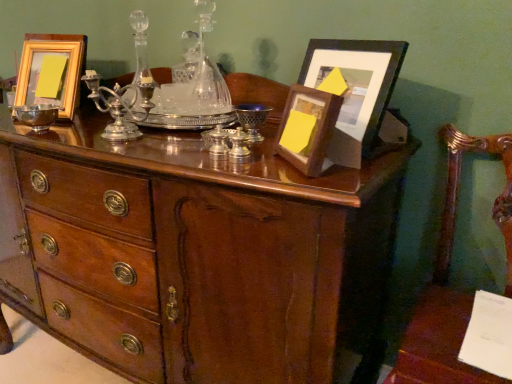
Locate an element on the screen. Image resolution: width=512 pixels, height=384 pixels. shiny silver wine glass at center is located at coordinates (252, 119).

Describe the element at coordinates (252, 119) in the screenshot. I see `shiny silver wine glass at center` at that location.

Where is `mahogany wood chest of drawers at center`? Image resolution: width=512 pixels, height=384 pixels. mahogany wood chest of drawers at center is located at coordinates (205, 249).

The width and height of the screenshot is (512, 384). What do you see at coordinates (355, 90) in the screenshot?
I see `matte black picture frame at upper right, the third picture frame viewed from the left` at bounding box center [355, 90].

In order to face matte black picture frame at upper right, the third picture frame viewed from the left, should I rotate leftwards or rightwards?

Rotate your view right by about 12.476°.

This screenshot has width=512, height=384. I want to click on shiny silver candle holder at center, which is the third candle holder in back-to-front order, so click(238, 145).

What do you see at coordinates (218, 141) in the screenshot?
I see `silver metallic candle holder at center, the second candle holder positioned from the front` at bounding box center [218, 141].

I want to click on shiny silver wine glass at center, so click(x=252, y=119).

Which of these two, shiny silver bowl at left or shiny silver wine glass at center, stands taller?

shiny silver wine glass at center.

Based on the photo, between shiny silver bowl at left and shiny silver wine glass at center, which one has larger width?

shiny silver wine glass at center is wider.

From a real-world perspective, between shiny silver bowl at left and shiny silver wine glass at center, who is vertically higher?

shiny silver wine glass at center.

Identify the location of glass bowl below the shiny silver wine glass at center (from a real-world perspective). (36, 116).

Could you tell me if matte black picture frame at upper right, which is the 1th picture frame from right to left, is facing shiny silver candle holder at center, which is the third candle holder in back-to-front order?

Yes, matte black picture frame at upper right, which is the 1th picture frame from right to left, is oriented towards shiny silver candle holder at center, which is the third candle holder in back-to-front order.

Would you say matte black picture frame at upper right, the third picture frame viewed from the left, is to the left or to the right of shiny silver candle holder at center, which is the third candle holder in back-to-front order, in the picture?

matte black picture frame at upper right, the third picture frame viewed from the left, is positioned on shiny silver candle holder at center, which is the third candle holder in back-to-front order,'s right side.

From the image's perspective, does matte black picture frame at upper right, which is the 1th picture frame from right to left, appear lower than shiny silver candle holder at center, the first candle holder viewed from the front?

Incorrect, from the image's perspective, matte black picture frame at upper right, which is the 1th picture frame from right to left, is higher than shiny silver candle holder at center, the first candle holder viewed from the front.

From the image's perspective, count 2nd picture frames upward from the shiny silver candle holder at center, which appears as the third candle holder when viewed from the left, and point to it. Please provide its 2D coordinates.

[(355, 90)]

Considering the relative sizes of wooden armchair at right and gold wooden picture frame at upper left, which appears as the 1th picture frame when viewed from the left, in the image provided, is wooden armchair at right wider than gold wooden picture frame at upper left, which appears as the 1th picture frame when viewed from the left,?

Indeed, wooden armchair at right has a greater width compared to gold wooden picture frame at upper left, which appears as the 1th picture frame when viewed from the left.

Is wooden armchair at right outside of gold wooden picture frame at upper left, the 3th picture frame in the right-to-left sequence?

That's correct, wooden armchair at right is outside of gold wooden picture frame at upper left, the 3th picture frame in the right-to-left sequence.

Considering the positions of point (426, 314) and point (50, 59), is point (426, 314) closer or farther from the camera than point (50, 59)?

Point (426, 314) is positioned closer to the camera compared to point (50, 59).

Is wooden armchair at right not near gold wooden picture frame at upper left, the 3th picture frame in the right-to-left sequence?

Yes.

What's the angular difference between wooden picture frame at upper right, which is the second picture frame from left to right, and matte black picture frame at upper right, the third picture frame viewed from the left,'s facing directions?

The facing directions of wooden picture frame at upper right, which is the second picture frame from left to right, and matte black picture frame at upper right, the third picture frame viewed from the left, are 16.1 degrees apart.

From the wooden picture frame at upper right, which is the second picture frame from left to right, count 1st picture frames backward and point to it. Please provide its 2D coordinates.

[(355, 90)]

Based on the photo, considering the sizes of wooden picture frame at upper right, which is the 2th picture frame from right to left, and matte black picture frame at upper right, which is the 1th picture frame from right to left, in the image, is wooden picture frame at upper right, which is the 2th picture frame from right to left, bigger or smaller than matte black picture frame at upper right, which is the 1th picture frame from right to left,?

Clearly, wooden picture frame at upper right, which is the 2th picture frame from right to left, is smaller in size than matte black picture frame at upper right, which is the 1th picture frame from right to left.

Based on their positions, is wooden armchair at right located to the left or right of silver metallic candle holder at center, the second candle holder positioned from the front?

wooden armchair at right is positioned on silver metallic candle holder at center, the second candle holder positioned from the front,'s right side.

From a real-world perspective, between wooden armchair at right and silver metallic candle holder at center, marked as the 2th candle holder in a right-to-left arrangement, who is vertically lower?

From a 3D spatial view, wooden armchair at right is below.

In terms of size, does wooden armchair at right appear bigger or smaller than silver metallic candle holder at center, the second candle holder viewed from the left?

wooden armchair at right is bigger than silver metallic candle holder at center, the second candle holder viewed from the left.

What's the angular difference between shiny silver bowl at left and wooden armchair at right's facing directions?

There is a 3.79-degree angle between the facing directions of shiny silver bowl at left and wooden armchair at right.

Between point (30, 106) and point (508, 187), which one is positioned in front?

The point (508, 187) is more forward.

Consider the image. From the image's perspective, which one is positioned higher, shiny silver bowl at left or wooden armchair at right?

From the image's view, shiny silver bowl at left is above.

Is there a large distance between shiny silver bowl at left and wooden armchair at right?

Yes.

What are the coordinates of `the 2nd candle holder in front of the gold wooden picture frame at upper left, the 3th picture frame in the right-to-left sequence, counting from the anchor's position` in the screenshot? It's located at (218, 141).

From a real-world perspective, between gold wooden picture frame at upper left, the 3th picture frame in the right-to-left sequence, and silver metallic candle holder at center, marked as the 2th candle holder in a right-to-left arrangement, who is vertically lower?

In real-world perspective, silver metallic candle holder at center, marked as the 2th candle holder in a right-to-left arrangement, is lower.

Which of these two, gold wooden picture frame at upper left, which appears as the 1th picture frame when viewed from the left, or silver metallic candle holder at center, the second candle holder positioned from the front, is smaller?

Smaller between the two is silver metallic candle holder at center, the second candle holder positioned from the front.

Is gold wooden picture frame at upper left, which appears as the 1th picture frame when viewed from the left, facing towards silver metallic candle holder at center, the second candle holder positioned from the front?

No, gold wooden picture frame at upper left, which appears as the 1th picture frame when viewed from the left, is not turned towards silver metallic candle holder at center, the second candle holder positioned from the front.

In order to click on glass bowl on the left of shiny silver wine glass at center in this screenshot , I will do `click(36, 116)`.

Find the location of `the 2nd picture frame above the shiny silver candle holder at center, which is counted as the 1th candle holder, starting from the right (from the image's perspective)`. the 2nd picture frame above the shiny silver candle holder at center, which is counted as the 1th candle holder, starting from the right (from the image's perspective) is located at coordinates (355, 90).

Considering their positions, is silver polished candle holder at center, which appears as the first candle holder when viewed from the back, positioned further to silver metallic candle holder at center, marked as the 2th candle holder in a right-to-left arrangement, than shiny silver bowl at left?

The object further to silver metallic candle holder at center, marked as the 2th candle holder in a right-to-left arrangement, is shiny silver bowl at left.

Looking at the image, which one is located further to white paper at lower right, matte black picture frame at upper right, which is the 1th picture frame from right to left, or shiny silver candle holder at center, which is counted as the 1th candle holder, starting from the right?

shiny silver candle holder at center, which is counted as the 1th candle holder, starting from the right.

Considering their positions, is shiny silver candle holder at center, which is counted as the 1th candle holder, starting from the right, positioned further to matte black picture frame at upper right, which is the 1th picture frame from right to left, than shiny silver wine glass at center?

shiny silver candle holder at center, which is counted as the 1th candle holder, starting from the right, is positioned further to the anchor matte black picture frame at upper right, which is the 1th picture frame from right to left.

Considering their positions, is silver metallic candle holder at center, the second candle holder positioned from the front, positioned further to wooden picture frame at upper right, which is the second picture frame from left to right, than shiny silver bowl at left?

The object further to wooden picture frame at upper right, which is the second picture frame from left to right, is shiny silver bowl at left.

From the image, which object appears to be nearer to shiny silver wine glass at center, wooden armchair at right or gold wooden picture frame at upper left, the 3th picture frame in the right-to-left sequence?

wooden armchair at right lies closer to shiny silver wine glass at center than the other object.

Based on their spatial positions, is mahogany wood chest of drawers at center or shiny silver wine glass at center further from wooden armchair at right?

Among the two, shiny silver wine glass at center is located further to wooden armchair at right.

Which object lies further to the anchor point silver metallic candle holder at center, the second candle holder viewed from the left, wooden armchair at right or matte black picture frame at upper right, the third picture frame viewed from the left?

wooden armchair at right is positioned further to the anchor silver metallic candle holder at center, the second candle holder viewed from the left.

Based on their spatial positions, is shiny silver bowl at left or mahogany wood chest of drawers at center further from wooden picture frame at upper right, which is the second picture frame from left to right?

Among the two, shiny silver bowl at left is located further to wooden picture frame at upper right, which is the second picture frame from left to right.

Identify the location of the chest of drawers located between silver polished candle holder at center, which appears as the first candle holder when viewed from the back, and white paper at lower right in the left-right direction. This screenshot has width=512, height=384. (205, 249).

Where is `picture frame situated between shiny silver bowl at left and matte black picture frame at upper right, the third picture frame viewed from the left, from left to right`? picture frame situated between shiny silver bowl at left and matte black picture frame at upper right, the third picture frame viewed from the left, from left to right is located at coordinates (307, 128).

At what (x,y) coordinates should I click in order to perform the action: click on glass bowl between gold wooden picture frame at upper left, which appears as the 1th picture frame when viewed from the left, and mahogany wood chest of drawers at center in the up-down direction. Please return your answer as a coordinate pair (x, y). The width and height of the screenshot is (512, 384). Looking at the image, I should click on tap(36, 116).

You are a GUI agent. You are given a task and a screenshot of the screen. Output one action in this format:
    pyautogui.click(x=<x>, y=<y>)
    Task: Click on the chest of drawers located between silver polished candle holder at center, acting as the 3th candle holder starting from the right, and wooden picture frame at upper right, which is the second picture frame from left to right, in the left-right direction
    The height and width of the screenshot is (384, 512).
    Given the screenshot: What is the action you would take?
    pyautogui.click(x=205, y=249)